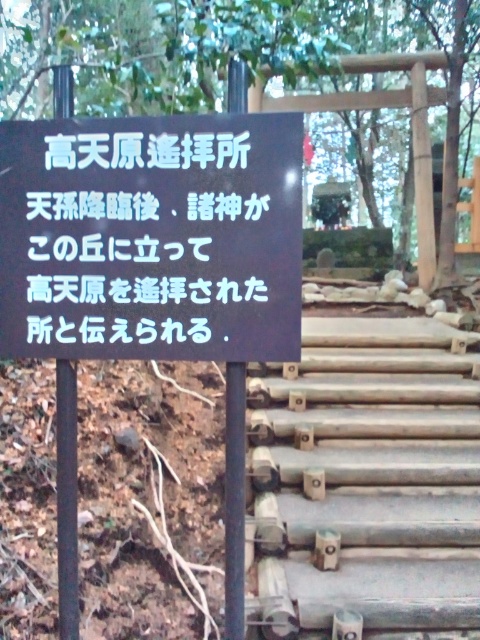
You are standing at the entrance of the shrine and want to read the information on the black matte sign at center. Since you are 1.7 meters tall, can you see the bottom edge of the sign without needing to look up?

The position of black matte sign at center is at point 0.317 on the vertical axis, which corresponds to approximately 1.7 meters height. Therefore, you can see the bottom edge of the sign without needing to look up.

Looking at this image, you are visiting a shrine and want to read the information on the black matte sign at center. To do so, do you need to climb up or go down the smooth wooden stairs at center?

The black matte sign at center is located above the smooth wooden stairs at center, so you need to climb up the stairs to reach it.

You are a visitor at the shrine and want to read the black matte sign at center. However, there are smooth wooden stairs at center in the way. Can you still read the sign without climbing the stairs?

The black matte sign at center has a lesser height compared to smooth wooden stairs at center, so yes, you can read the sign without climbing the stairs because it is shorter than the stairs.